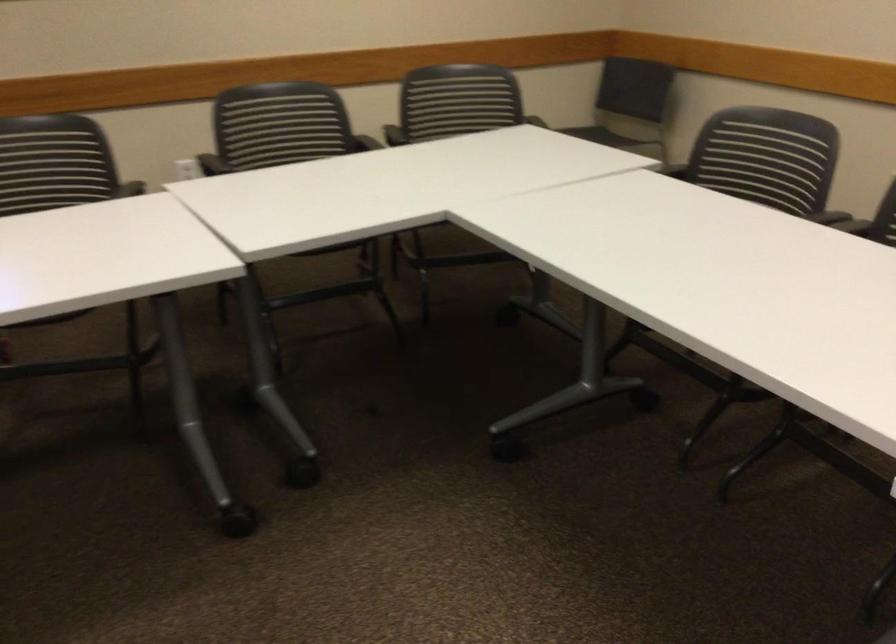
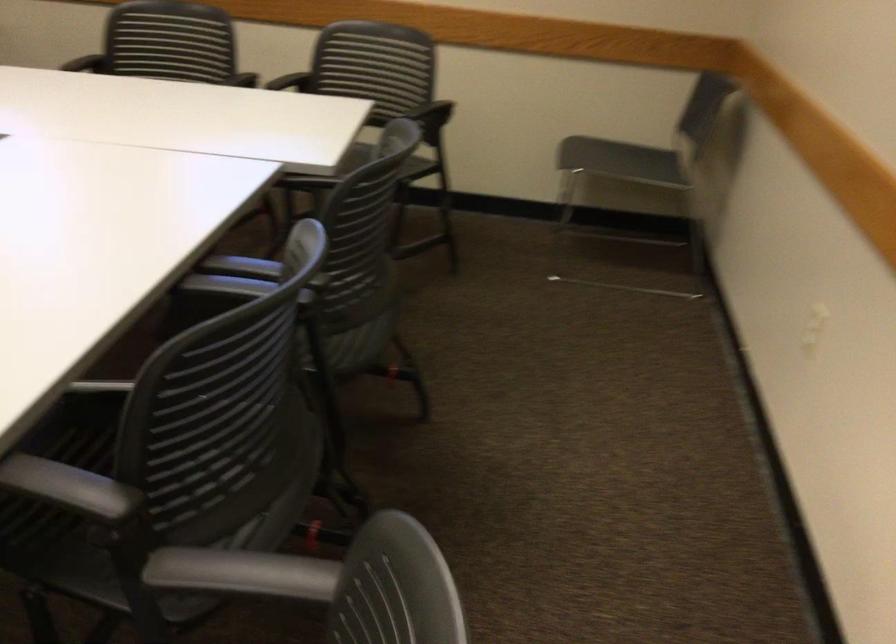
Locate, in the second image, the point that corresponds to point 448,111 in the first image.

(375, 73)